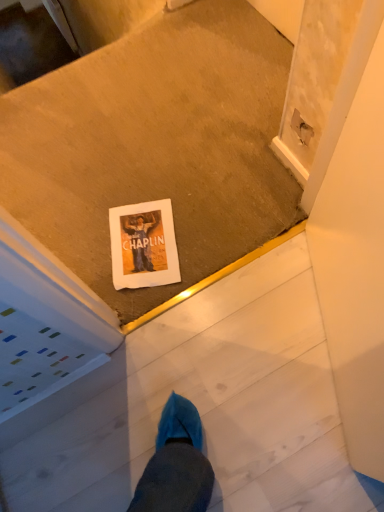
You are a GUI agent. You are given a task and a screenshot of the screen. Output one action in this format:
    pyautogui.click(x=<x>, y=<y>)
    Task: Click on the vacant area on the back side of white paper at center
    
    Given the screenshot: What is the action you would take?
    pyautogui.click(x=128, y=177)